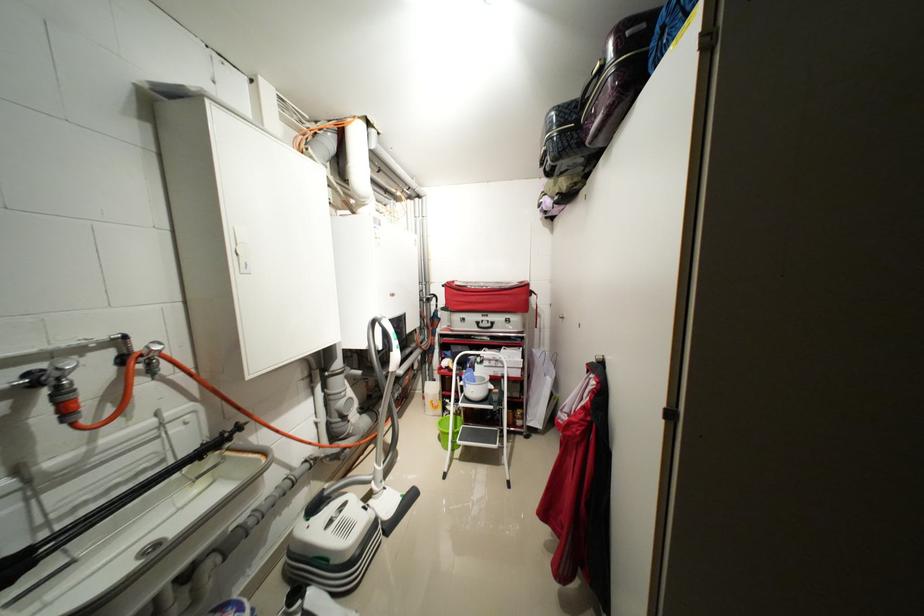
At what (x,y) coordinates should I click in order to perform the action: click on red suitcase. Please return your answer as a coordinate pair (x, y). Image resolution: width=924 pixels, height=616 pixels. Looking at the image, I should click on (487, 296).